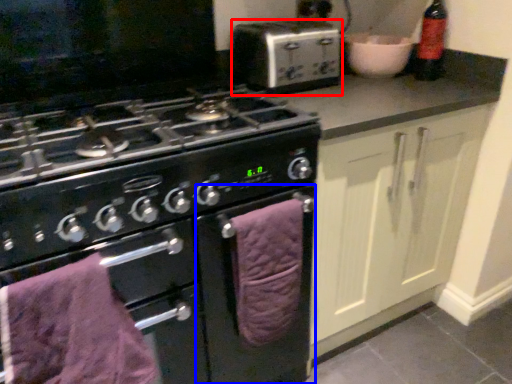
Question: Among these objects, which one is nearest to the camera, kitchen appliance (highlighted by a red box) or oven (highlighted by a blue box)?

Choices:
 (A) kitchen appliance
 (B) oven

Answer: (B)